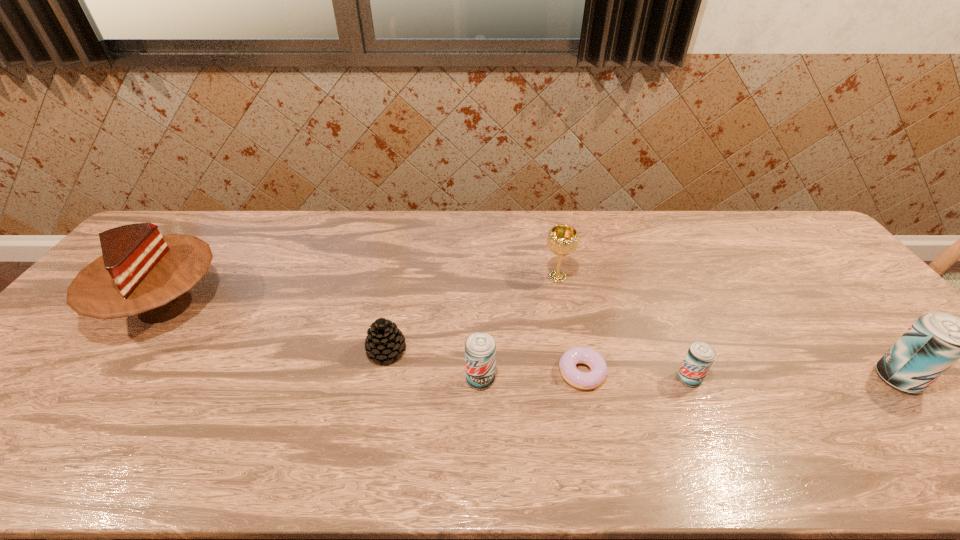
At what (x,y) coordinates should I click in order to perform the action: click on the fourth shortest object. Please return your answer as a coordinate pair (x, y). Image resolution: width=960 pixels, height=540 pixels. Looking at the image, I should click on (480, 348).

In order to click on the leftmost beer can in this screenshot , I will do `click(480, 348)`.

Identify the location of the shortest beer can. The width and height of the screenshot is (960, 540). (700, 356).

The width and height of the screenshot is (960, 540). Find the location of `the second beer can from right to left`. the second beer can from right to left is located at coordinates click(700, 356).

Where is `the rightmost object`? the rightmost object is located at coordinates (936, 340).

Find the location of `the rightmost beer can`. the rightmost beer can is located at coordinates (936, 340).

Find the location of a particular element. chalice is located at coordinates (562, 240).

Where is `cake`? The image size is (960, 540). cake is located at coordinates (140, 272).

You are a GUI agent. You are given a task and a screenshot of the screen. Output one action in this format:
    pyautogui.click(x=<x>, y=<y>)
    Task: Click on the second object from left to right
    This screenshot has width=960, height=540.
    Given the screenshot: What is the action you would take?
    pyautogui.click(x=384, y=341)

At what (x,y) coordinates should I click in order to perform the action: click on doughnut. Please return your answer as a coordinate pair (x, y). The image size is (960, 540). Looking at the image, I should click on [x=589, y=380].